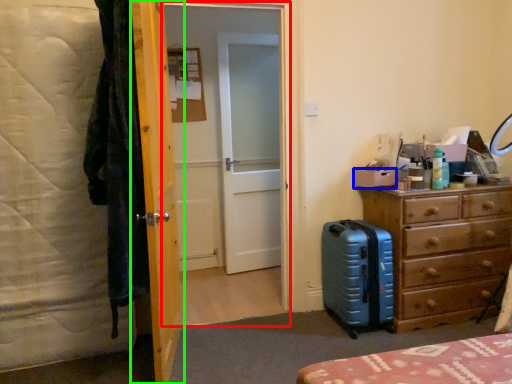
Question: Estimate the real-world distances between objects in this image. Which object is farther from screen door (highlighted by a red box), box (highlighted by a blue box) or door (highlighted by a green box)?

Choices:
 (A) box
 (B) door

Answer: (A)